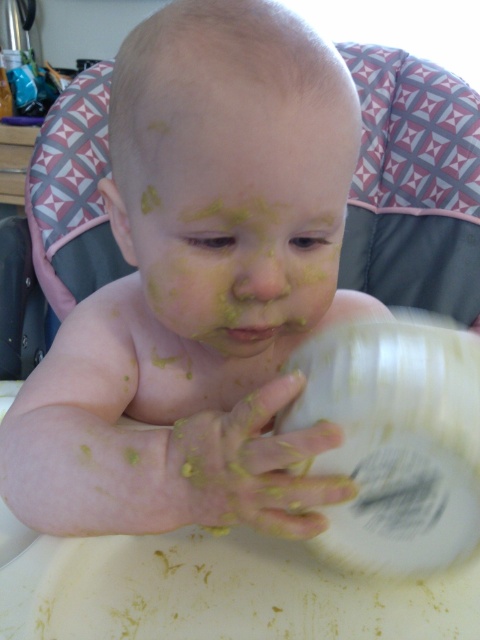
Question: Is yellowish matte plastic cup at lower center positioned at the back of yellowish paste at center?

Choices:
 (A) no
 (B) yes

Answer: (A)

Question: Is yellowish matte plastic cup at lower center above yellowish paste at center?

Choices:
 (A) yes
 (B) no

Answer: (A)

Question: Which is nearer to the yellowish matte plastic cup at lower center?

Choices:
 (A) yellow matte face at center
 (B) yellowish paste at center

Answer: (B)

Question: Among these points, which one is farthest from the camera?

Choices:
 (A) (418, 452)
 (B) (272, 484)
 (C) (266, 314)

Answer: (C)

Question: Which point is closer to the camera taking this photo?

Choices:
 (A) (267, 118)
 (B) (184, 337)
 (C) (295, 490)
 (D) (382, 548)

Answer: (C)

Question: Does yellow matte baby at center have a smaller size compared to yellow matte face at center?

Choices:
 (A) no
 (B) yes

Answer: (A)